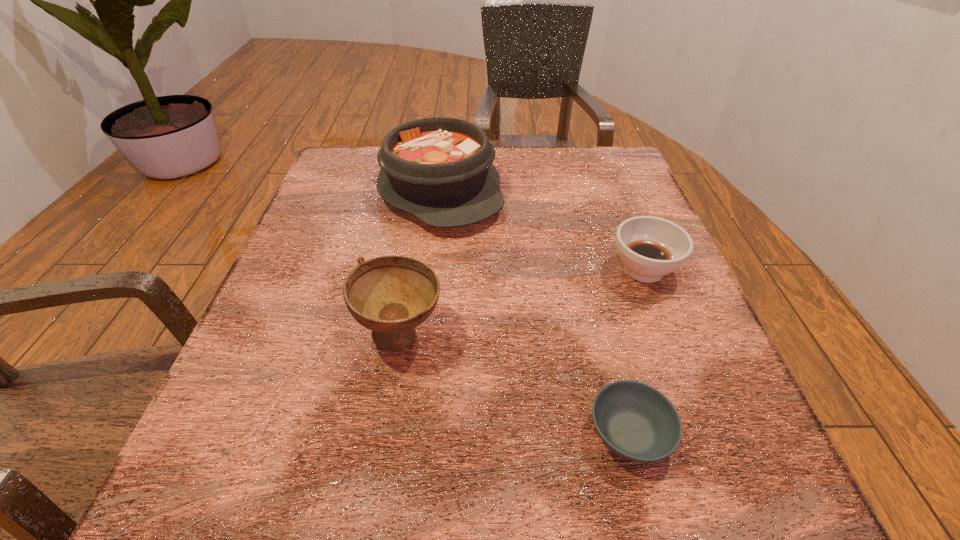
You are a GUI agent. You are given a task and a screenshot of the screen. Output one action in this format:
    pyautogui.click(x=<x>, y=<y>)
    Task: Click on the vacant space at the far left corner
    Image resolution: width=960 pixels, height=540 pixels.
    Given the screenshot: What is the action you would take?
    pyautogui.click(x=370, y=150)

Where is `vacant region at the near left corner of the desktop`? vacant region at the near left corner of the desktop is located at coordinates (254, 506).

Where is `vacant area that lies between the shortest object and the tallest soup bowl`? The height and width of the screenshot is (540, 960). vacant area that lies between the shortest object and the tallest soup bowl is located at coordinates (516, 383).

The height and width of the screenshot is (540, 960). In order to click on vacant space that is in between the farthest object and the nearest soup bowl in this screenshot , I will do `click(535, 312)`.

Find the location of a particular element. The height and width of the screenshot is (540, 960). free space between the nearest object and the third nearest object is located at coordinates (636, 352).

Where is `free space between the shortest object and the farthest object`? free space between the shortest object and the farthest object is located at coordinates (535, 312).

The width and height of the screenshot is (960, 540). I want to click on vacant space in between the shortest object and the second nearest soup bowl, so click(516, 383).

This screenshot has width=960, height=540. In order to click on vacant area between the tallest soup bowl and the shortest object in this screenshot , I will do `click(516, 383)`.

Where is `free spot between the second nearest object and the nearest soup bowl`? free spot between the second nearest object and the nearest soup bowl is located at coordinates (516, 383).

At what (x,y) coordinates should I click in order to perform the action: click on free space between the second tallest soup bowl and the nearest soup bowl. Please return your answer as a coordinate pair (x, y). Image resolution: width=960 pixels, height=540 pixels. Looking at the image, I should click on (636, 352).